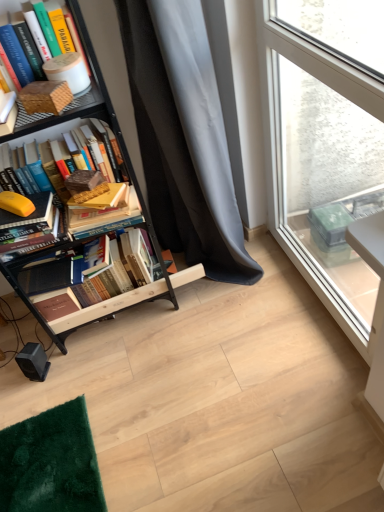
Question: Does gray fabric curtain at center have a lesser height compared to hardcover books at left, which appears as the 5th book when viewed from the top?

Choices:
 (A) no
 (B) yes

Answer: (A)

Question: Can you confirm if gray fabric curtain at center is positioned to the left of hardcover books at left, the first book ordered from the bottom?

Choices:
 (A) no
 (B) yes

Answer: (A)

Question: Does gray fabric curtain at center have a greater height compared to hardcover books at left, which appears as the 5th book when viewed from the top?

Choices:
 (A) no
 (B) yes

Answer: (B)

Question: From a real-world perspective, is gray fabric curtain at center physically above hardcover books at left, the first book ordered from the bottom?

Choices:
 (A) no
 (B) yes

Answer: (B)

Question: Is gray fabric curtain at center bigger than hardcover books at left, which appears as the 5th book when viewed from the top?

Choices:
 (A) no
 (B) yes

Answer: (B)

Question: Is point (38, 124) closer or farther from the camera than point (62, 114)?

Choices:
 (A) farther
 (B) closer

Answer: (A)

Question: In terms of width, does black metal bookcase at left look wider or thinner when compared to matte brown book at upper left, which is the first book in top-to-bottom order?

Choices:
 (A) thin
 (B) wide

Answer: (B)

Question: From their relative heights in the image, would you say black metal bookcase at left is taller or shorter than matte brown book at upper left, which ranks as the fifth book in bottom-to-top order?

Choices:
 (A) tall
 (B) short

Answer: (A)

Question: Is black metal bookcase at left inside the boundaries of matte brown book at upper left, which is the first book in top-to-bottom order, or outside?

Choices:
 (A) inside
 (B) outside

Answer: (B)

Question: Is matte orange book at left, which appears as the 2th book when ordered from the bottom, in front of or behind hardcover books at left, the first book ordered from the bottom, in the image?

Choices:
 (A) behind
 (B) front

Answer: (B)

Question: From the image's perspective, is matte orange book at left, which appears as the 2th book when ordered from the bottom, positioned above or below hardcover books at left, which appears as the 5th book when viewed from the top?

Choices:
 (A) above
 (B) below

Answer: (A)

Question: In the image, is matte orange book at left, the fourth book from the top, on the left side or the right side of hardcover books at left, which appears as the 5th book when viewed from the top?

Choices:
 (A) left
 (B) right

Answer: (A)

Question: In terms of size, does matte orange book at left, which appears as the 2th book when ordered from the bottom, appear bigger or smaller than hardcover books at left, which appears as the 5th book when viewed from the top?

Choices:
 (A) small
 (B) big

Answer: (A)

Question: Considering the positions of orange matte banana at lower left, placed as the third book when sorted from top to bottom, and matte brown book at upper left, which is the first book in top-to-bottom order, in the image, is orange matte banana at lower left, placed as the third book when sorted from top to bottom, bigger or smaller than matte brown book at upper left, which is the first book in top-to-bottom order,?

Choices:
 (A) big
 (B) small

Answer: (B)

Question: Do you think orange matte banana at lower left, acting as the 3th book starting from the bottom, is within matte brown book at upper left, which is the first book in top-to-bottom order, or outside of it?

Choices:
 (A) outside
 (B) inside

Answer: (A)